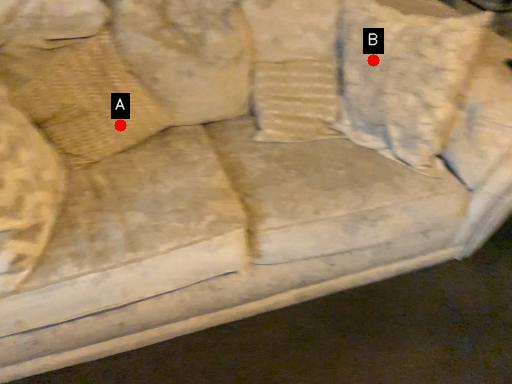
Question: Two points are circled on the image, labeled by A and B beside each circle. Among these points, which one is nearest to the camera?

Choices:
 (A) A is closer
 (B) B is closer

Answer: (A)